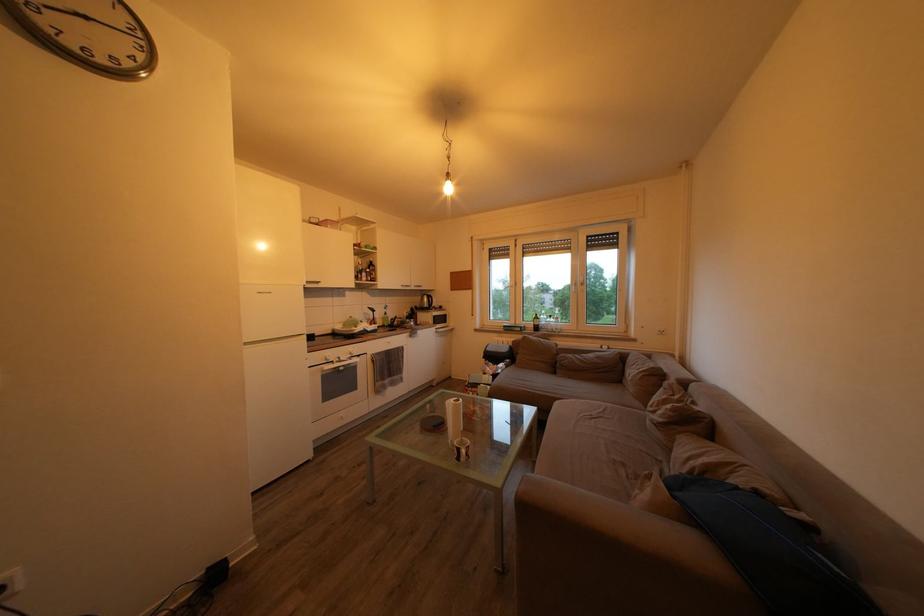
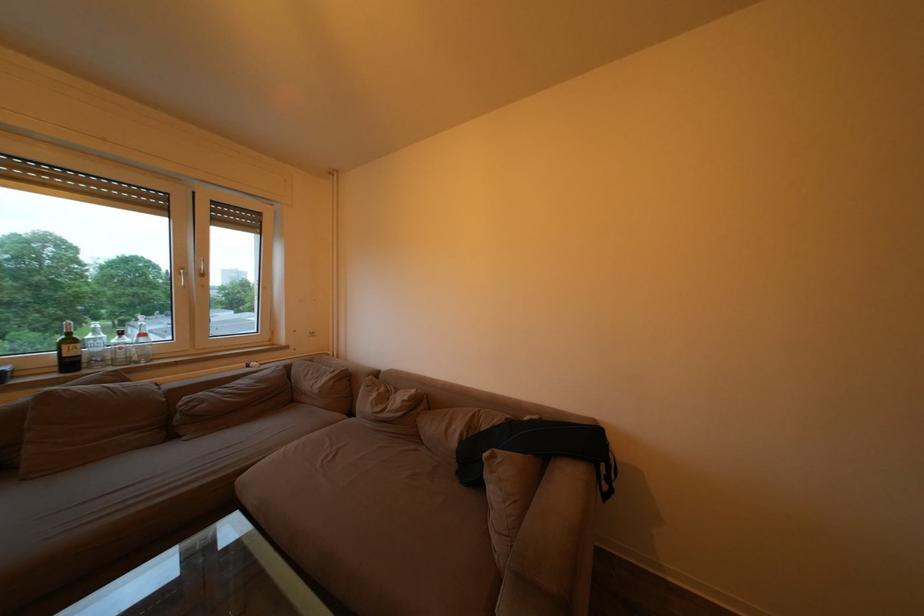
Question: I am providing you with two images of the same scene from different viewpoints. Please identify which objects are invisible in image2.

Choices:
 (A) sofa sitting surface
 (B) clear glass bottle
 (C) silver window handle
 (D) none of these

Answer: (D)